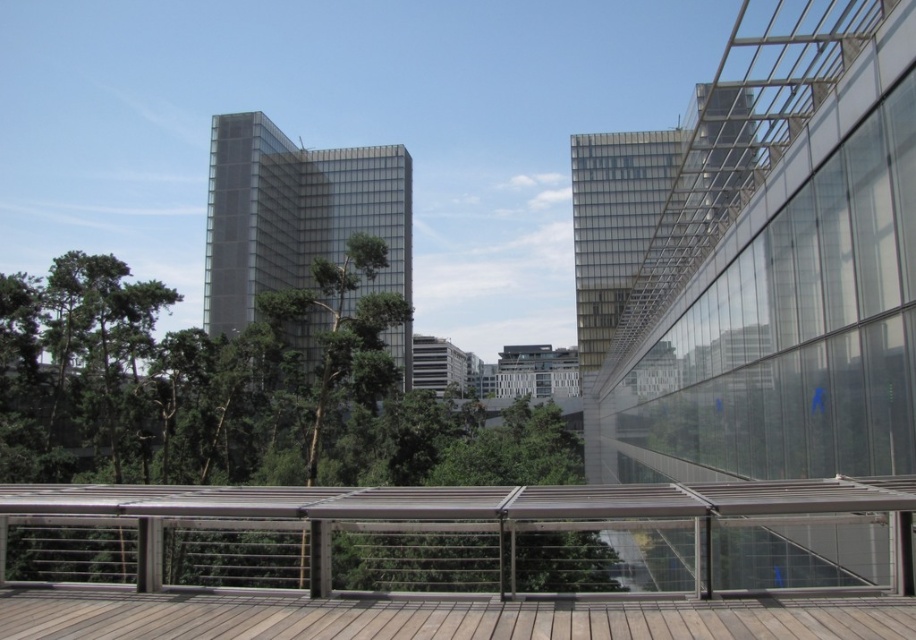
Question: Does green leafy tree at center appear over wooden deck at lower center?

Choices:
 (A) no
 (B) yes

Answer: (A)

Question: Where is green leafy tree at center located in relation to wooden deck at lower center in the image?

Choices:
 (A) below
 (B) above

Answer: (A)

Question: Estimate the real-world distances between objects in this image. Which object is closer to the green leafy tree at center?

Choices:
 (A) wooden deck at center
 (B) wooden deck at lower center

Answer: (A)

Question: Which of the following is the closest to the observer?

Choices:
 (A) (52, 618)
 (B) (791, 481)
 (C) (329, 296)

Answer: (A)

Question: Which point is farther from the camera taking this photo?

Choices:
 (A) (34, 570)
 (B) (351, 486)
 (C) (247, 604)

Answer: (B)

Question: Does green leafy tree at center have a larger size compared to wooden deck at lower center?

Choices:
 (A) yes
 (B) no

Answer: (A)